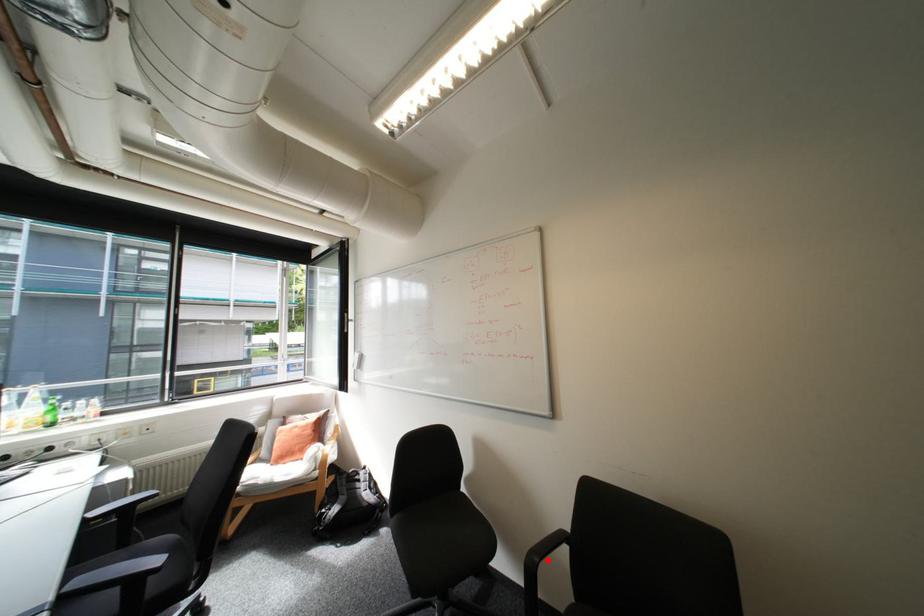
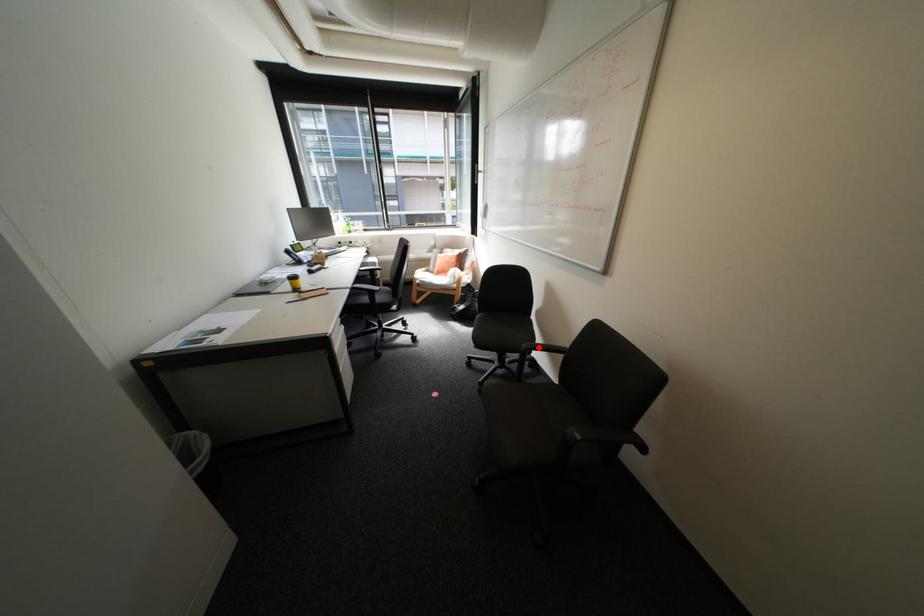
I am providing you with two images of the same scene from different viewpoints. A red point is marked on the first image and another point is marked on the second image. Do the highlighted points in image1 and image2 indicate the same real-world spot?

Yes